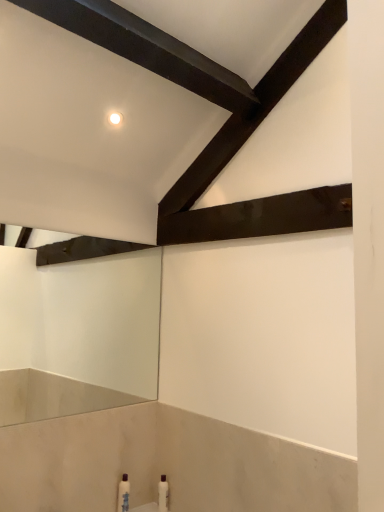
What do you see at coordinates (163, 494) in the screenshot? I see `white glossy bottle at lower center` at bounding box center [163, 494].

The width and height of the screenshot is (384, 512). In order to click on white glossy bottle at lower center in this screenshot , I will do `click(163, 494)`.

Locate an element on the screen. white glossy bottle at lower center is located at coordinates (163, 494).